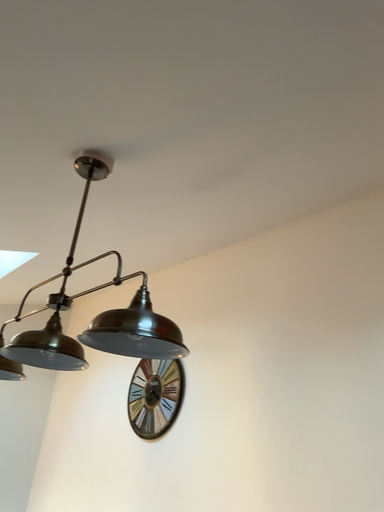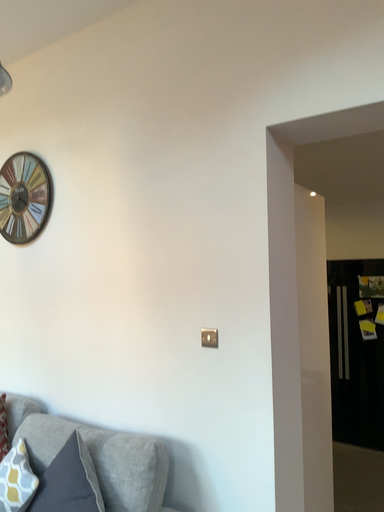
Question: How did the camera likely rotate when shooting the video?

Choices:
 (A) rotated downward
 (B) rotated upward

Answer: (A)